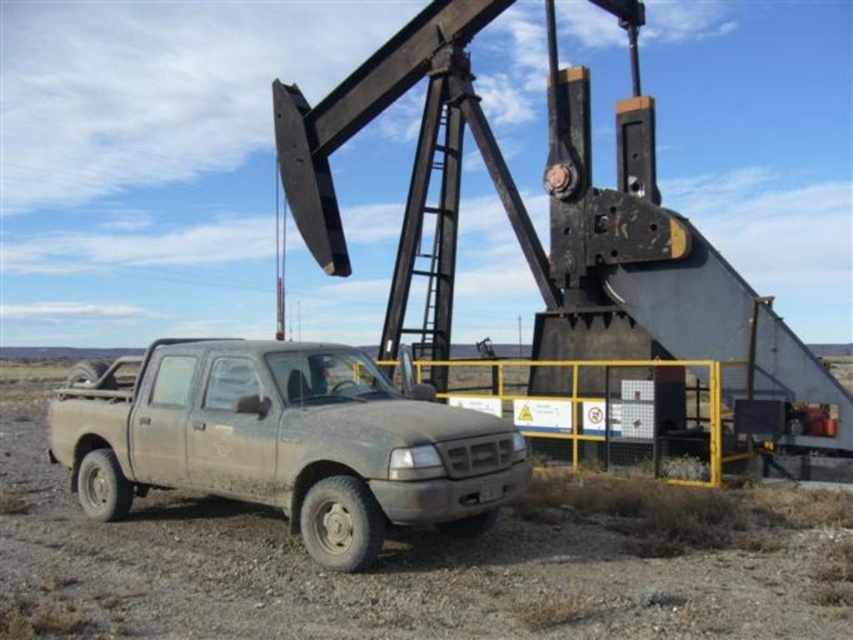
You are a photographer trying to capture the dusty matte pickup truck at lower left and the dull gray dirt field at center in a single shot. Based on their positions, which object should you focus on first to ensure both are in frame?

The dull gray dirt field at center is positioned on the left side of dusty matte pickup truck at lower left, so you should focus on the dusty matte pickup truck at lower left first to ensure both objects are within the frame.

You are a surveyor trying to locate the dull gray dirt field at center in the image. According to the coordinates provided, where exactly is it positioned?

The dull gray dirt field at center is located at point coordinates of (428, 561).